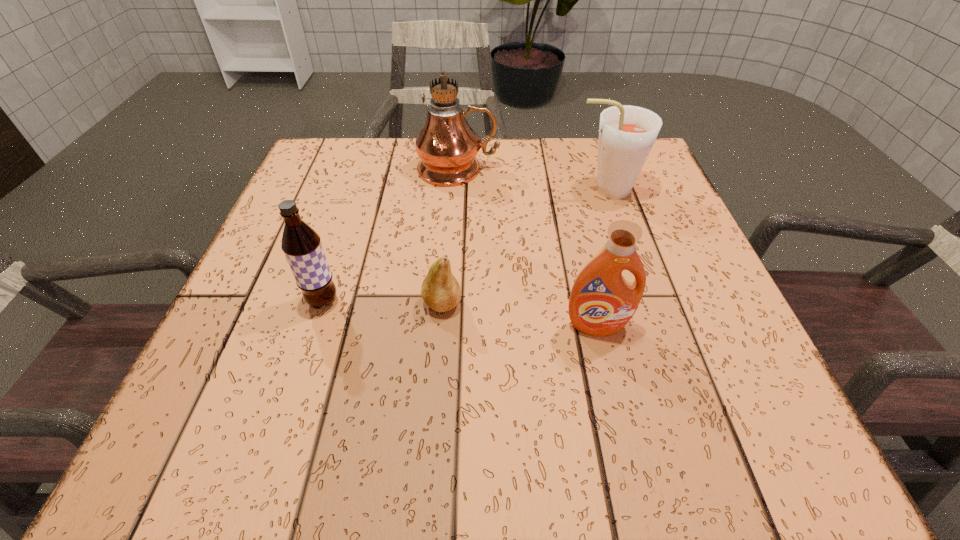
Find the location of a particular element. the tallest object is located at coordinates (447, 146).

The image size is (960, 540). What are the coordinates of `the right root beer` in the screenshot? It's located at (627, 133).

Where is `the left root beer`? Image resolution: width=960 pixels, height=540 pixels. the left root beer is located at coordinates (301, 244).

You are a GUI agent. You are given a task and a screenshot of the screen. Output one action in this format:
    pyautogui.click(x=<x>, y=<y>)
    Task: Click on the leftmost object
    The image size is (960, 540).
    Given the screenshot: What is the action you would take?
    pyautogui.click(x=301, y=244)

This screenshot has width=960, height=540. I want to click on detergent, so click(602, 301).

You are a GUI agent. You are given a task and a screenshot of the screen. Output one action in this format:
    pyautogui.click(x=<x>, y=<y>)
    Task: Click on the pear
    This screenshot has height=540, width=960.
    Given the screenshot: What is the action you would take?
    pyautogui.click(x=440, y=290)

At what (x,y) coordinates should I click in order to perform the action: click on vacant space located on the right of the tallest object. Please return your answer as a coordinate pair (x, y). The height and width of the screenshot is (540, 960). Looking at the image, I should click on (655, 169).

The width and height of the screenshot is (960, 540). I want to click on vacant space located 0.210m on the drink side of the farther root beer, so [x=481, y=190].

The image size is (960, 540). I want to click on free space located 0.390m on the drink side of the farther root beer, so click(x=404, y=190).

You are a GUI agent. You are given a task and a screenshot of the screen. Output one action in this format:
    pyautogui.click(x=<x>, y=<y>)
    Task: Click on the vacant space positioned 0.240m on the drink side of the farther root beer
    The height and width of the screenshot is (540, 960).
    Given the screenshot: What is the action you would take?
    pyautogui.click(x=468, y=190)